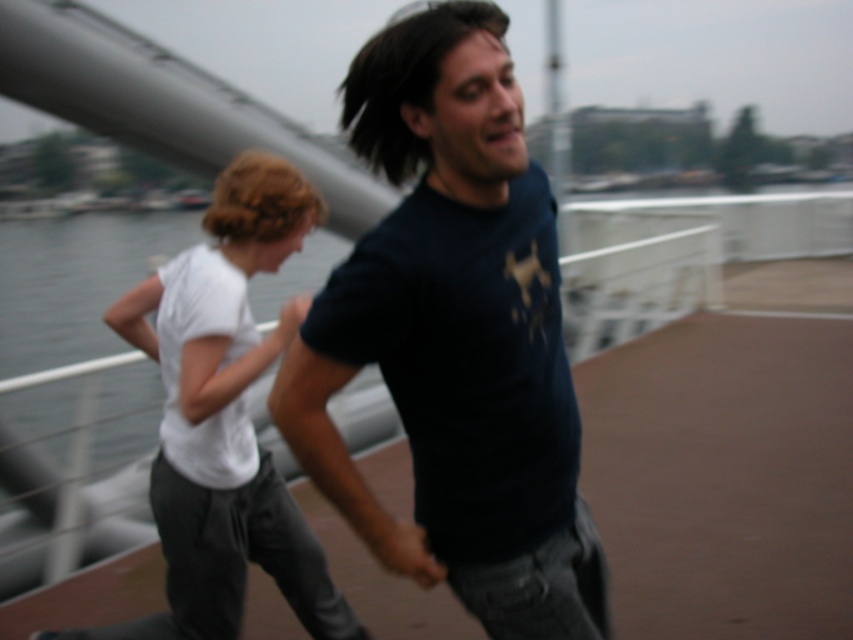
Question: Can you confirm if dark blue t-shirt at center is wider than white cotton shirt at center?

Choices:
 (A) no
 (B) yes

Answer: (A)

Question: Does dark blue t-shirt at center appear under white cotton shirt at center?

Choices:
 (A) yes
 (B) no

Answer: (B)

Question: Does dark blue t-shirt at center have a smaller size compared to white cotton shirt at center?

Choices:
 (A) yes
 (B) no

Answer: (A)

Question: Which object is closer to the camera taking this photo?

Choices:
 (A) white cotton shirt at center
 (B) dark blue t-shirt at center

Answer: (B)

Question: Which point appears closest to the camera in this image?

Choices:
 (A) (347, 275)
 (B) (256, 500)

Answer: (A)